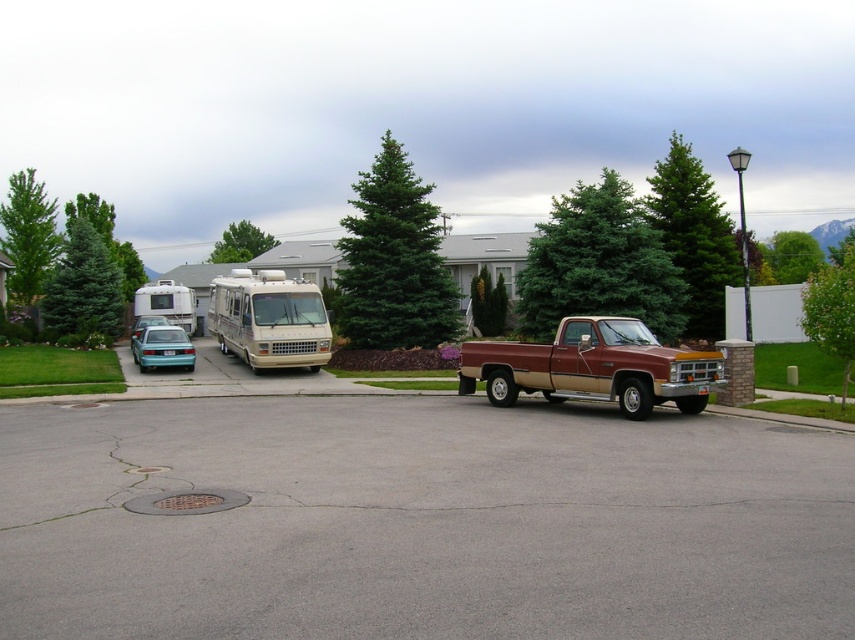
You are a delivery person needing to park your vehicle. You see the matte gold truck at center and the green textured pine tree at left. Which object is providing shade for the truck?

The green textured pine tree at left is positioned above the matte gold truck at center, so it is providing shade for the truck.

You are standing at the center of the parking lot and want to find the green leafy tree at left. According to the coordinates provided, in which direction should you walk to reach it?

The green leafy tree at left is located at point 0.369 on the x and 0.034 on the y. Since you are at the center, you should walk towards the left side of the parking lot to reach it.

You are standing in the suburban residential area and want to find the gray asphalt parking lot at center. Which direction should you look relative to the green matte tree at center?

The gray asphalt parking lot at center is located below the green matte tree at center, so you should look downward from the green matte tree at center to find it.